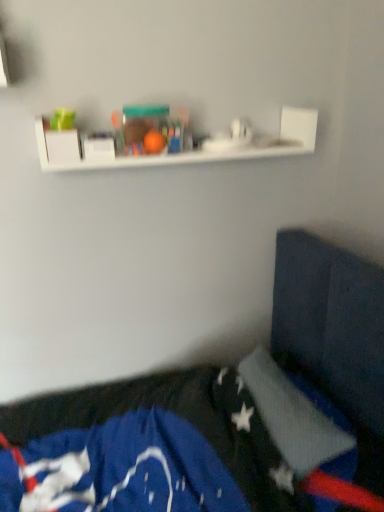
Locate an element on the screen. The image size is (384, 512). white matte shelf at upper center is located at coordinates (201, 151).

Measure the distance between white matte shelf at upper center and camera.

white matte shelf at upper center is 3.56 feet from camera.

The image size is (384, 512). Describe the element at coordinates (201, 151) in the screenshot. I see `white matte shelf at upper center` at that location.

Locate an element on the screen. white matte shelf at upper center is located at coordinates (201, 151).